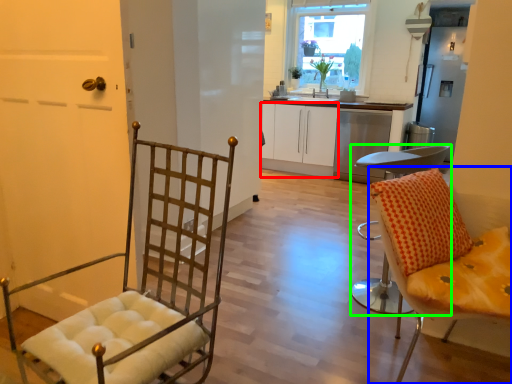
Question: Considering the real-world distances, which object is farthest from cabinetry (highlighted by a red box)? chair (highlighted by a blue box) or chair (highlighted by a green box)?

Choices:
 (A) chair
 (B) chair

Answer: (A)